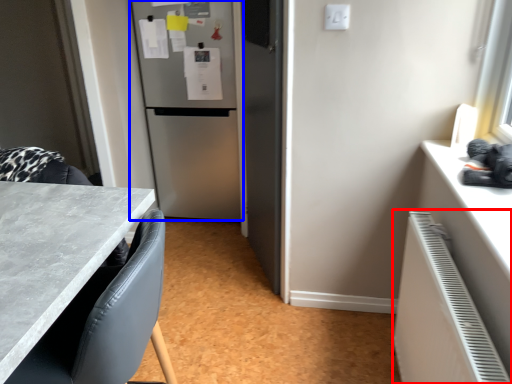
Question: Which of the following is the farthest to the observer, radiator (highlighted by a red box) or refrigerator (highlighted by a blue box)?

Choices:
 (A) radiator
 (B) refrigerator

Answer: (B)